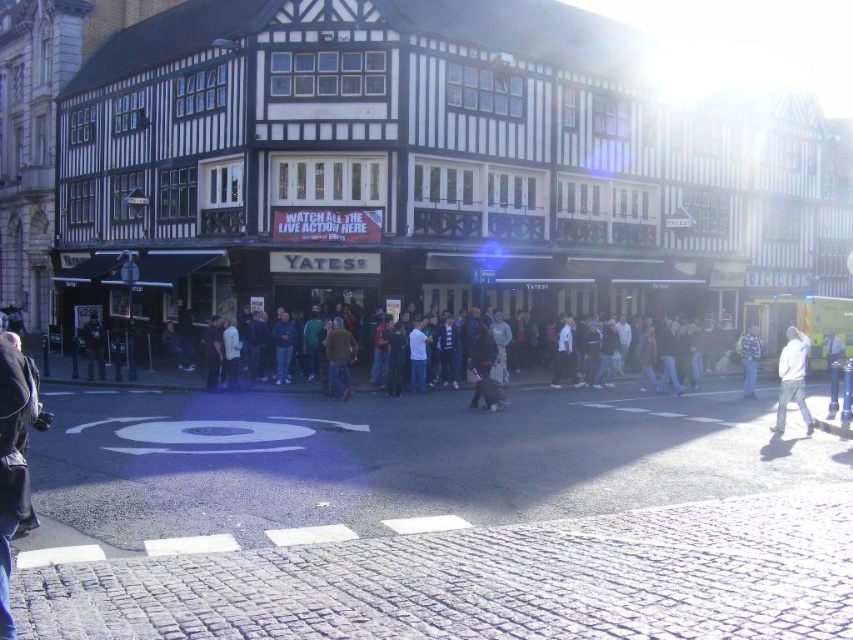
You are a photographer trying to capture a candid shot of the crowd at the Yates building. You notice the white matte jacket at lower right and the dark blue jeans at lower left. Which clothing item should you focus on if you want to capture the widest subject in your frame?

The white matte jacket at lower right might be wider than dark blue jeans at lower left, so focusing on the white matte jacket at lower right would likely capture the widest subject in your frame.

You are a photographer trying to capture a candid shot of the crowd at the Yates building. You notice a person wearing a white matte jacket at lower right and dark blue jeans at lower right. Which clothing item would appear more prominent in your photo?

The white matte jacket at lower right is larger in size than the dark blue jeans at lower right, so it would appear more prominent in the photo.